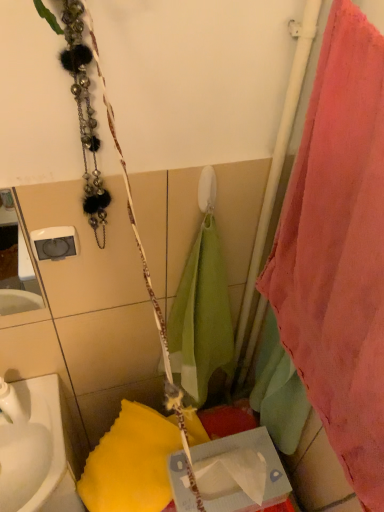
Question: Considering the positions of point (0, 492) and point (301, 330), is point (0, 492) closer or farther from the camera than point (301, 330)?

Choices:
 (A) farther
 (B) closer

Answer: (A)

Question: Is white glossy sink at lower left situated inside pink fabric towel at right or outside?

Choices:
 (A) inside
 (B) outside

Answer: (B)

Question: Which object is the farthest from the pink fabric towel at right?

Choices:
 (A) cardboard tissue box at center
 (B) white glossy sink at lower left

Answer: (B)

Question: Which of these objects is positioned closest to the white glossy sink at lower left?

Choices:
 (A) cardboard tissue box at center
 (B) pink fabric towel at right

Answer: (A)